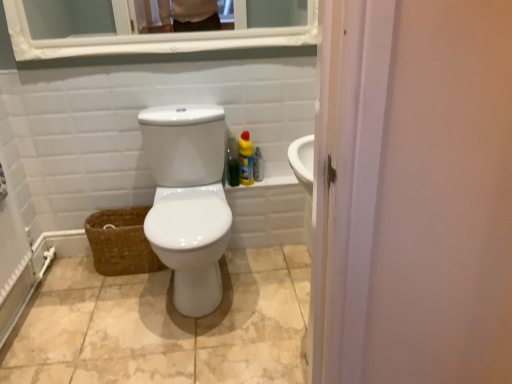
Question: Can you confirm if brown woven basket at lower left is smaller than yellow matte bottle at right, which is the first cleaning product in left-to-right order?

Choices:
 (A) yes
 (B) no

Answer: (B)

Question: Is the position of brown woven basket at lower left more distant than that of yellow matte bottle at right, which is the first cleaning product in left-to-right order?

Choices:
 (A) no
 (B) yes

Answer: (A)

Question: Does brown woven basket at lower left have a lesser width compared to yellow matte bottle at right, the second cleaning product from the right?

Choices:
 (A) yes
 (B) no

Answer: (B)

Question: Is brown woven basket at lower left positioned far away from yellow matte bottle at right, the second cleaning product from the right?

Choices:
 (A) yes
 (B) no

Answer: (B)

Question: From the image's perspective, is brown woven basket at lower left located beneath yellow matte bottle at right, which is the first cleaning product in left-to-right order?

Choices:
 (A) no
 (B) yes

Answer: (B)

Question: Is brown woven basket at lower left at the right side of yellow matte bottle at right, which is the first cleaning product in left-to-right order?

Choices:
 (A) no
 (B) yes

Answer: (A)

Question: Does white glossy medicine cabinet at upper center come in front of beige ceramic tile at center?

Choices:
 (A) yes
 (B) no

Answer: (B)

Question: From a real-world perspective, is white glossy medicine cabinet at upper center physically below beige ceramic tile at center?

Choices:
 (A) no
 (B) yes

Answer: (A)

Question: Does white glossy medicine cabinet at upper center appear on the left side of beige ceramic tile at center?

Choices:
 (A) no
 (B) yes

Answer: (B)

Question: Is white glossy medicine cabinet at upper center not close to beige ceramic tile at center?

Choices:
 (A) yes
 (B) no

Answer: (A)

Question: Considering the relative sizes of white glossy medicine cabinet at upper center and beige ceramic tile at center in the image provided, is white glossy medicine cabinet at upper center bigger than beige ceramic tile at center?

Choices:
 (A) yes
 (B) no

Answer: (B)

Question: From the image's perspective, would you say white glossy medicine cabinet at upper center is shown under beige ceramic tile at center?

Choices:
 (A) yes
 (B) no

Answer: (B)

Question: From the image's perspective, is yellow matte bottle at right, the second cleaning product from the right, beneath clear plastic spray bottle at right, the 1th cleaning product when ordered from right to left?

Choices:
 (A) no
 (B) yes

Answer: (A)